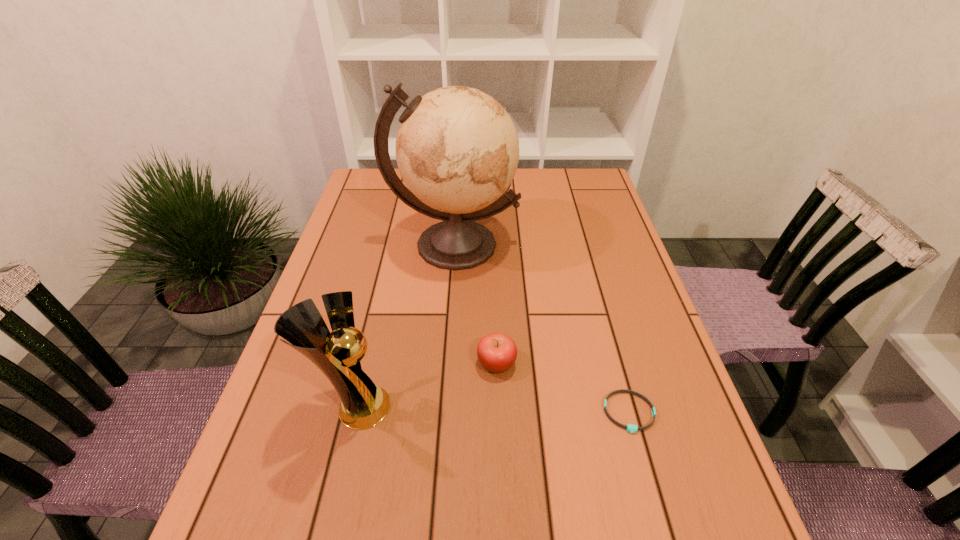
The image size is (960, 540). What are the coordinates of `globe that is positioned at the left edge` in the screenshot? It's located at pos(457,149).

Where is `award located in the left edge section of the desktop`? This screenshot has height=540, width=960. award located in the left edge section of the desktop is located at coordinates (363, 405).

Find the location of `object that is at the right edge`. object that is at the right edge is located at coordinates (631, 428).

At what (x,y) coordinates should I click in order to perform the action: click on vacant region at the far edge of the desktop. Please return your answer as a coordinate pair (x, y). Looking at the image, I should click on (548, 172).

Locate an element on the screen. Image resolution: width=960 pixels, height=540 pixels. vacant region at the left edge of the desktop is located at coordinates (283, 374).

Where is `free region at the right edge`? This screenshot has height=540, width=960. free region at the right edge is located at coordinates (640, 513).

You are a GUI agent. You are given a task and a screenshot of the screen. Output one action in this format:
    pyautogui.click(x=<x>, y=<y>)
    Task: Click on the vacant area at the far right corner
    
    Given the screenshot: What is the action you would take?
    pyautogui.click(x=592, y=205)

What are the coordinates of `unoccupied position between the globe and the wristband` in the screenshot? It's located at (541, 329).

Locate an element on the screen. vacant space that's between the tallest object and the third shortest object is located at coordinates (404, 326).

Where is `vacant space that's between the rightmost object and the apple`? The height and width of the screenshot is (540, 960). vacant space that's between the rightmost object and the apple is located at coordinates (563, 388).